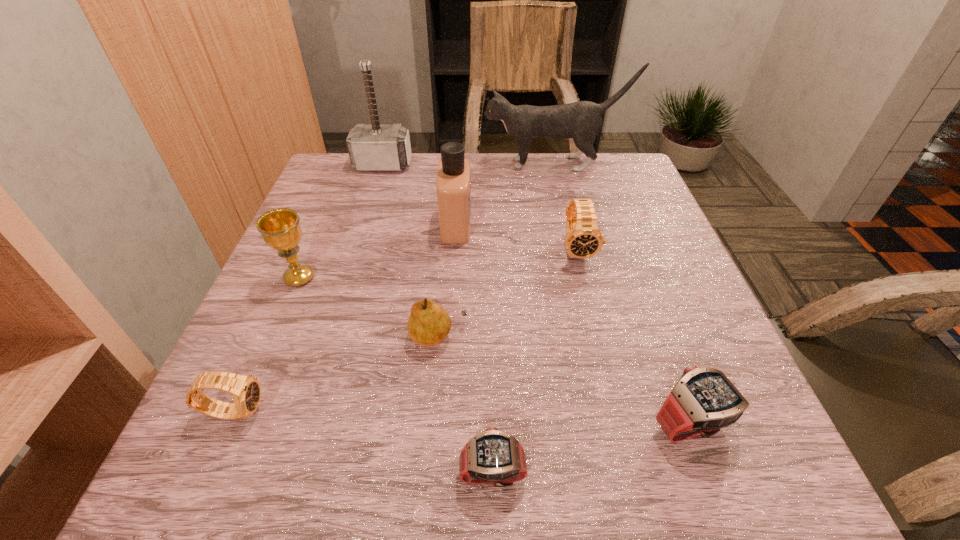
Locate an element on the screen. Image resolution: width=960 pixels, height=540 pixels. hammer is located at coordinates (374, 147).

You are a GUI agent. You are given a task and a screenshot of the screen. Output one action in this format:
    pyautogui.click(x=<x>, y=<y>)
    Task: Click on the cat
    This screenshot has height=540, width=960.
    Given the screenshot: What is the action you would take?
    pyautogui.click(x=581, y=121)

Identify the location of beige perfume. (453, 183).

Identify the location of perfume. This screenshot has width=960, height=540. (453, 183).

What are the coordinates of `the fourth tallest object` in the screenshot? It's located at (280, 229).

Locate an element on the screen. Image resolution: width=960 pixels, height=540 pixels. chalice is located at coordinates (280, 229).

The height and width of the screenshot is (540, 960). In order to click on the fifth tallest object in this screenshot , I will do `click(583, 239)`.

Locate an element on the screen. The image size is (960, 540). the tallest watch is located at coordinates (583, 239).

The width and height of the screenshot is (960, 540). I want to click on the fourth nearest object, so click(428, 324).

The image size is (960, 540). Find the location of `the right red watch`. the right red watch is located at coordinates (704, 400).